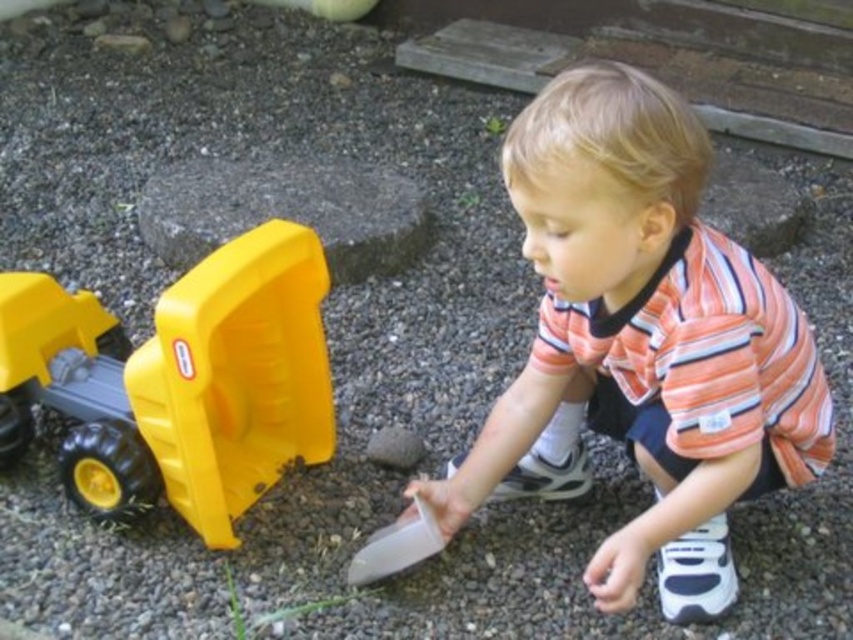
Question: Which point appears farthest from the camera in this image?

Choices:
 (A) (54, 280)
 (B) (590, 570)

Answer: (A)

Question: Can you confirm if orange striped shirt at center is positioned to the right of yellow plastic toy truck at left?

Choices:
 (A) yes
 (B) no

Answer: (A)

Question: Which of the following is the farthest from the observer?

Choices:
 (A) (665, 387)
 (B) (306, 355)

Answer: (B)

Question: Can you confirm if orange striped shirt at center is positioned to the right of yellow plastic toy truck at left?

Choices:
 (A) yes
 (B) no

Answer: (A)

Question: Can you confirm if orange striped shirt at center is bigger than yellow plastic toy truck at left?

Choices:
 (A) yes
 (B) no

Answer: (A)